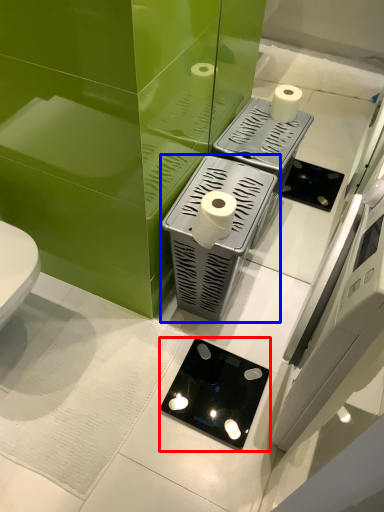
Question: Which object appears farthest to the camera in this image, appliance (highlighted by a red box) or appliance (highlighted by a blue box)?

Choices:
 (A) appliance
 (B) appliance

Answer: (A)